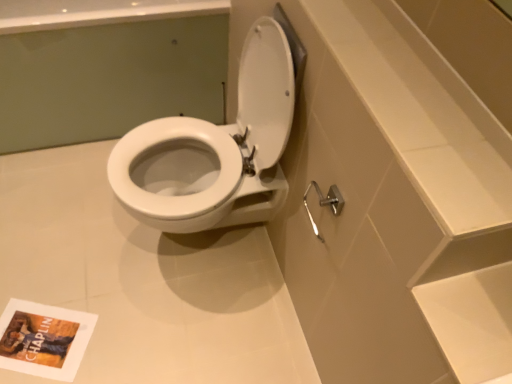
Question: Looking at their shapes, would you say white glossy toilet at center is wider or thinner than matte paper book cover at lower left?

Choices:
 (A) wide
 (B) thin

Answer: (A)

Question: Considering their positions, is white glossy toilet at center located in front of or behind matte paper book cover at lower left?

Choices:
 (A) behind
 (B) front

Answer: (B)

Question: Estimate the real-world distances between objects in this image. Which object is closer to the matte paper book cover at lower left?

Choices:
 (A) white glossy toilet at center
 (B) white glossy toilet at center
 (C) satin nickel shower arm at lower right

Answer: (B)

Question: Based on their relative distances, which object is farther from the matte paper book cover at lower left?

Choices:
 (A) white glossy toilet at center
 (B) satin nickel shower arm at lower right
 (C) white glossy toilet at center

Answer: (B)